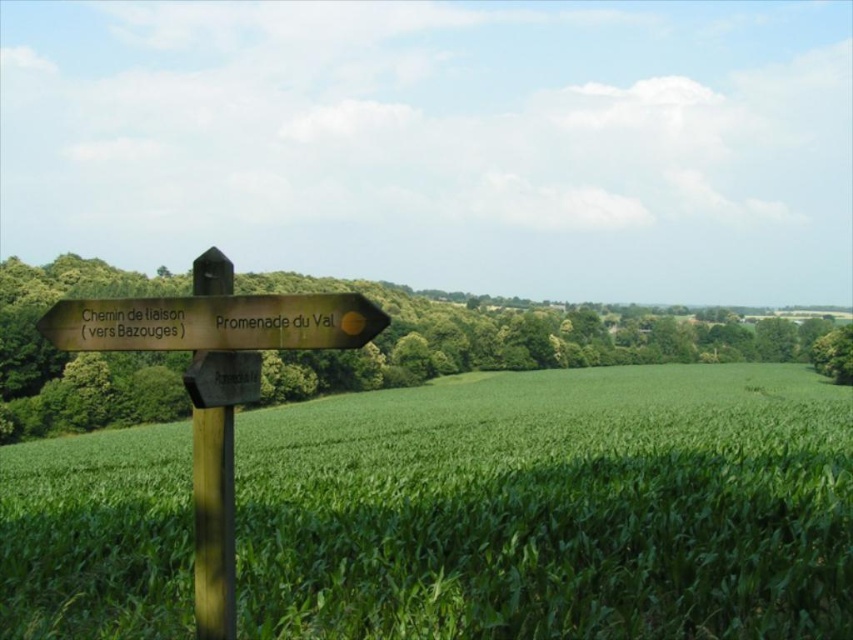
Question: Can you confirm if green leafy tree at left is smaller than wooden signpost at center-left?

Choices:
 (A) yes
 (B) no

Answer: (B)

Question: Which point is farther to the camera?

Choices:
 (A) (38, 301)
 (B) (16, 467)
 (C) (200, 458)
 (D) (218, 376)

Answer: (A)

Question: Which point is farther to the camera?

Choices:
 (A) (207, 248)
 (B) (221, 497)

Answer: (A)

Question: Among these points, which one is farthest from the camera?

Choices:
 (A) (554, 330)
 (B) (57, 342)
 (C) (613, 444)
 (D) (86, 333)

Answer: (A)

Question: Can you confirm if green grassy field at center is wider than wooden signpost at left?

Choices:
 (A) yes
 (B) no

Answer: (A)

Question: Is wooden signpost at left further to the viewer compared to wooden post at left?

Choices:
 (A) no
 (B) yes

Answer: (A)